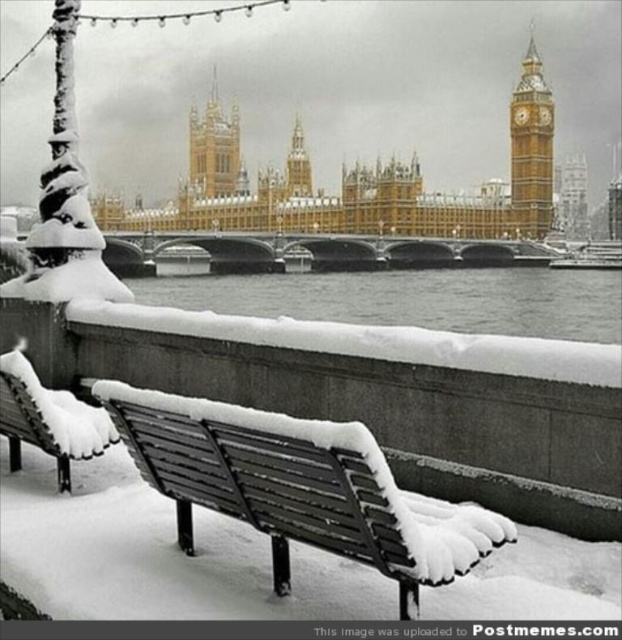
Question: From the image, what is the correct spatial relationship of metallic park bench at lower left in relation to golden stone clock tower at upper right?

Choices:
 (A) above
 (B) below

Answer: (B)

Question: Which is nearer to the golden stone clock tower at upper right?

Choices:
 (A) wooden park bench at lower left
 (B) gold/golden stone tower at center

Answer: (B)

Question: Can you confirm if golden stone clock tower at upper right is positioned above gold/golden stone tower at center?

Choices:
 (A) no
 (B) yes

Answer: (A)

Question: Is wooden park bench at lower left smaller than golden stone clock tower at upper right?

Choices:
 (A) yes
 (B) no

Answer: (A)

Question: Which object appears closest to the camera in this image?

Choices:
 (A) gold/golden stone tower at center
 (B) wooden park bench at lower left

Answer: (B)

Question: Which point is closer to the camera?

Choices:
 (A) wooden park bench at lower left
 (B) golden stone clock tower at upper right
 (C) gold/golden stone tower at center
 (D) metallic park bench at lower left

Answer: (D)